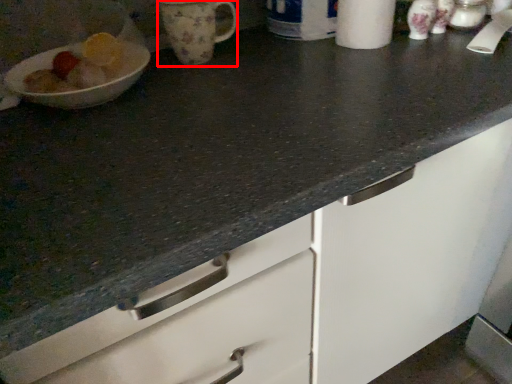
Question: From the image's perspective, considering the relative positions of mug (annotated by the red box) and paper towel in the image provided, where is mug (annotated by the red box) located with respect to the staircase?

Choices:
 (A) below
 (B) above

Answer: (A)